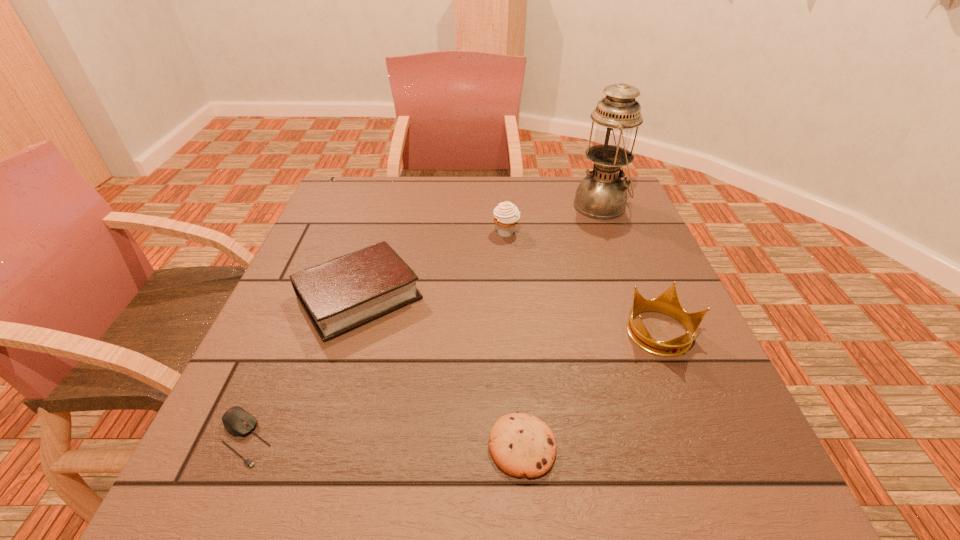
Find the location of `vacant area between the crown and the tallest object`. vacant area between the crown and the tallest object is located at coordinates (631, 269).

The height and width of the screenshot is (540, 960). Find the location of `free space between the tallest object and the second farthest object`. free space between the tallest object and the second farthest object is located at coordinates (554, 219).

Locate an element on the screen. The image size is (960, 540). vacant point located between the mouse and the fourth tallest object is located at coordinates (301, 367).

The image size is (960, 540). In order to click on free space between the fifth nearest object and the farthest object in this screenshot , I will do `click(554, 219)`.

Where is `free spot between the fifth shortest object and the crown`? Image resolution: width=960 pixels, height=540 pixels. free spot between the fifth shortest object and the crown is located at coordinates (584, 283).

At what (x,y) coordinates should I click in order to perform the action: click on vacant space that's between the crown and the muffin. Please return your answer as a coordinate pair (x, y). Looking at the image, I should click on (584, 283).

In order to click on vacant space in between the mouse and the cookie in this screenshot , I will do `click(383, 442)`.

The image size is (960, 540). I want to click on free space between the Bible and the muffin, so click(x=433, y=265).

In order to click on object that ranks as the fifth closest to the fourth tallest object in this screenshot , I will do `click(602, 195)`.

What are the coordinates of `object that is the fifth closest to the muffin` in the screenshot? It's located at [x=238, y=422].